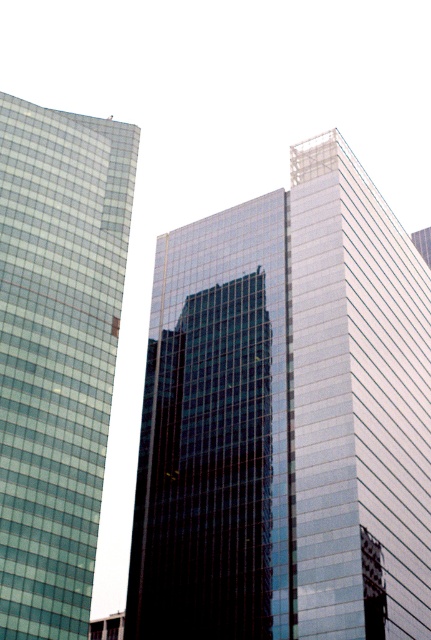
In the scene shown: Who is taller, glassy reflective skyscraper at center or green glass building at left?

green glass building at left is taller.

Describe the element at coordinates (286, 419) in the screenshot. This screenshot has width=431, height=640. I see `glassy reflective skyscraper at center` at that location.

Between point (309, 317) and point (13, 378), which one is positioned behind?

Positioned behind is point (309, 317).

The width and height of the screenshot is (431, 640). I want to click on glassy reflective skyscraper at center, so click(x=286, y=419).